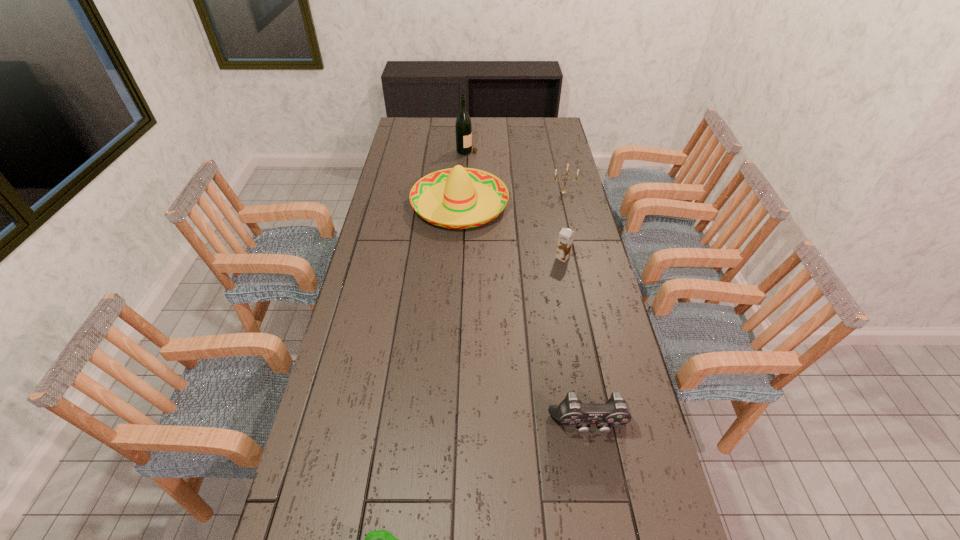
Where is `vacant position located 0.190m on the surface of the control with buttons`? vacant position located 0.190m on the surface of the control with buttons is located at coordinates (606, 521).

Find the location of a particular element. The image size is (960, 540). object positioned at the left edge is located at coordinates (456, 198).

The height and width of the screenshot is (540, 960). Find the location of `candle that is at the right edge`. candle that is at the right edge is located at coordinates (563, 191).

Locate an element on the screen. The height and width of the screenshot is (540, 960). chocolate milk positioned at the right edge is located at coordinates (565, 240).

Where is `control at the right edge`? The height and width of the screenshot is (540, 960). control at the right edge is located at coordinates (571, 412).

Identify the location of free space at the far edge of the desktop. (477, 119).

This screenshot has width=960, height=540. What are the coordinates of `vacant space at the left edge` in the screenshot? It's located at (387, 198).

This screenshot has width=960, height=540. In the image, there is a desktop. Find the location of `vacant area at the right edge`. vacant area at the right edge is located at coordinates (549, 197).

Image resolution: width=960 pixels, height=540 pixels. In the image, there is a desktop. What are the coordinates of `vacant space at the far right corner` in the screenshot? It's located at (559, 137).

Where is `vacant area that lies between the fifth farthest object and the sombrero`? This screenshot has width=960, height=540. vacant area that lies between the fifth farthest object and the sombrero is located at coordinates (524, 315).